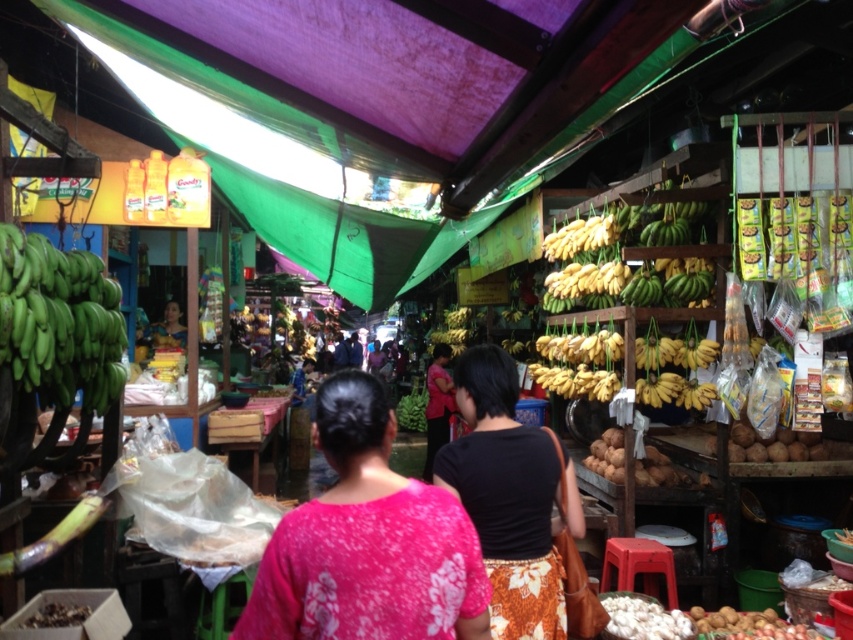
Looking at this image, you are a customer at the market and want to buy bananas. You notice the yellow matte bananas at upper center and the matte black hair at center. Which item is closer to the ground?

The yellow matte bananas at upper center is not as tall as matte black hair at center, so the yellow matte bananas at upper center is closer to the ground.

You are a vendor at the market and need to decide which item to place on a narrow shelf. The shelf can only accommodate the narrower of the two items. Which item should you choose between the black fabric shirt at center and the yellow matte bananas at upper center?

You should choose the yellow matte bananas at upper center because the black fabric shirt at center is wider than the yellow matte bananas at upper center.

You are a customer at the market and want to see the bananas at the vendor stall. The vendor is wearing a pink floral blouse at center. Can you see the green matte bananas at left clearly from your current position?

The pink floral blouse at center is in front of the green matte bananas at left, so the bananas might be partially obscured by the blouse.